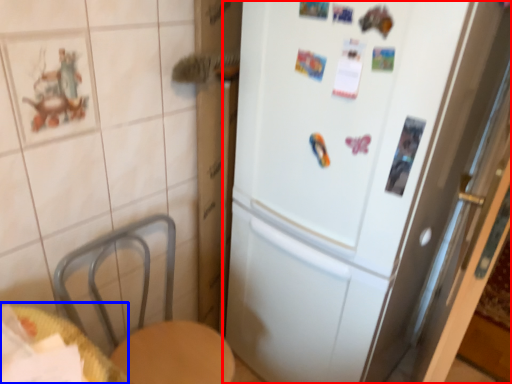
Question: Which of the following is the closest to the observer, refrigerator (highlighted by a red box) or table (highlighted by a blue box)?

Choices:
 (A) refrigerator
 (B) table

Answer: (B)